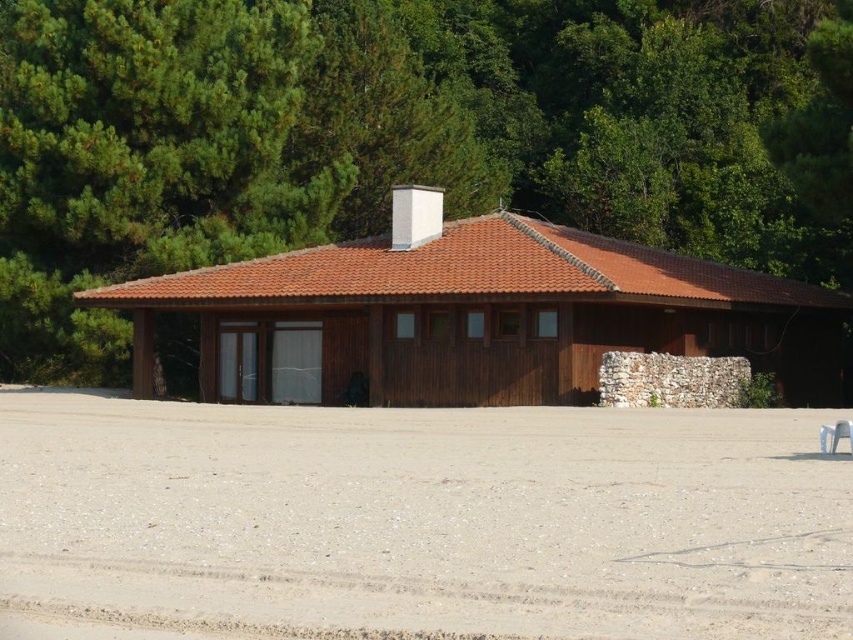
Question: Does gray gravel at lower center have a lesser width compared to brown wooden hut at center?

Choices:
 (A) yes
 (B) no

Answer: (A)

Question: Which object is the closest to the gray gravel at lower center?

Choices:
 (A) brown wooden hut at center
 (B) green leafy tree at upper center

Answer: (A)

Question: Is gray gravel at lower center thinner than brown wooden hut at center?

Choices:
 (A) yes
 (B) no

Answer: (A)

Question: Which point is farther to the camera?

Choices:
 (A) brown wooden hut at center
 (B) gray gravel at lower center

Answer: (A)

Question: Based on their relative distances, which object is nearer to the brown wooden hut at center?

Choices:
 (A) gray gravel at lower center
 (B) green leafy tree at upper center

Answer: (B)

Question: Can you confirm if green leafy tree at upper center is bigger than gray gravel at lower center?

Choices:
 (A) yes
 (B) no

Answer: (A)